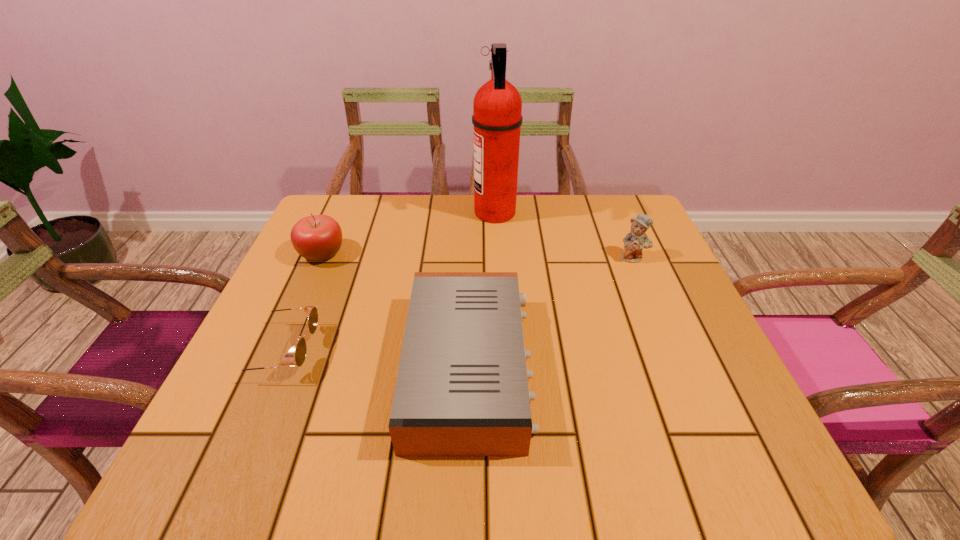
This screenshot has width=960, height=540. Identify the location of vacant area at the far edge. (470, 216).

The width and height of the screenshot is (960, 540). In the image, there is a desktop. In order to click on free space at the near edge in this screenshot , I will do `click(584, 456)`.

Locate an element on the screen. Image resolution: width=960 pixels, height=540 pixels. vacant space at the left edge of the desktop is located at coordinates (289, 372).

In the image, there is a desktop. In order to click on vacant space at the right edge in this screenshot , I will do `click(612, 273)`.

The width and height of the screenshot is (960, 540). In the image, there is a desktop. Find the location of `blank space at the far left corner`. blank space at the far left corner is located at coordinates (346, 204).

At what (x,y) coordinates should I click in order to perform the action: click on free point between the sunglasses and the fire extinguisher. Please return your answer as a coordinate pair (x, y). The height and width of the screenshot is (540, 960). Looking at the image, I should click on (388, 282).

You are a GUI agent. You are given a task and a screenshot of the screen. Output one action in this format:
    pyautogui.click(x=<x>, y=<y>)
    Task: Click on the free space between the apple and the tallest object
    This screenshot has height=540, width=960.
    Given the screenshot: What is the action you would take?
    pyautogui.click(x=408, y=233)

Where is `vacant region between the sunglasses and the radio receiver`? The image size is (960, 540). vacant region between the sunglasses and the radio receiver is located at coordinates (375, 359).

You are a GUI agent. You are given a task and a screenshot of the screen. Output one action in this format:
    pyautogui.click(x=<x>, y=<y>)
    Task: Click on the free point between the rightmost object and the apple
    The image size is (960, 540).
    Given the screenshot: What is the action you would take?
    pyautogui.click(x=477, y=255)

Locate an element on the screen. The height and width of the screenshot is (540, 960). free spot between the apple and the rightmost object is located at coordinates (477, 255).